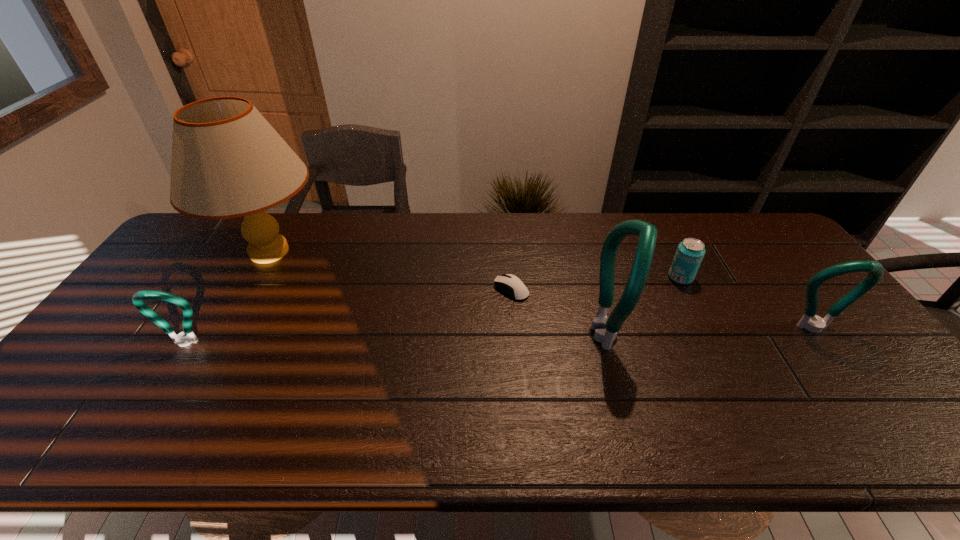
Find the location of a particular element. Image resolution: width=960 pixels, height=540 pixels. the shortest bottle opener is located at coordinates (181, 339).

Locate an element on the screen. The width and height of the screenshot is (960, 540). the leftmost bottle opener is located at coordinates pyautogui.click(x=181, y=339).

You are a GUI agent. You are given a task and a screenshot of the screen. Output one action in this format:
    pyautogui.click(x=<x>, y=<y>)
    Task: Click on the fourth object from left to right
    
    Given the screenshot: What is the action you would take?
    pyautogui.click(x=606, y=328)

This screenshot has width=960, height=540. What are the coordinates of `the second bottle opener from left to right` in the screenshot? It's located at pyautogui.click(x=606, y=328).

Where is `the rightmost bottle opener`? the rightmost bottle opener is located at coordinates (816, 324).

The width and height of the screenshot is (960, 540). Identify the location of the third tallest object. (816, 324).

Find the location of `lampshade`. lampshade is located at coordinates (227, 161).

Locate an element on the screen. The width and height of the screenshot is (960, 540). mouse is located at coordinates (510, 284).

Find the location of a particular element. the fourth object from right to left is located at coordinates (510, 284).

Identify the location of the fifth tallest object. (690, 252).